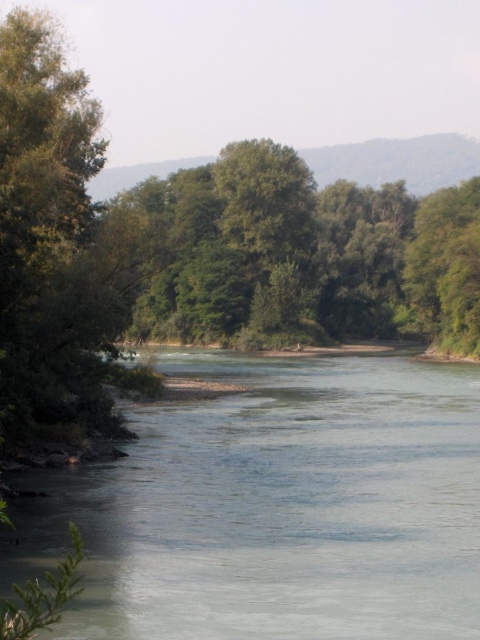
What do you see at coordinates (58, 248) in the screenshot? The height and width of the screenshot is (640, 480). I see `green leafy tree at left` at bounding box center [58, 248].

Can you confirm if green leafy tree at left is thinner than green leafy tree at center?

Correct, green leafy tree at left's width is less than green leafy tree at center's.

This screenshot has width=480, height=640. In order to click on green leafy tree at left in this screenshot , I will do `click(58, 248)`.

Which is above, clear water at center or green leafy tree at left?

green leafy tree at left is above.

Is clear water at center smaller than green leafy tree at left?

Yes.

Between point (224, 552) and point (60, 54), which one is positioned behind?

Point (60, 54)

Find the location of a particular element. clear water at center is located at coordinates (279, 508).

Measure the distance from clear water at center to green leafy tree at center.

A distance of 231.85 meters exists between clear water at center and green leafy tree at center.

Is clear water at center in front of green leafy tree at center?

Yes.

Locate an element on the screen. This screenshot has width=480, height=640. clear water at center is located at coordinates (279, 508).